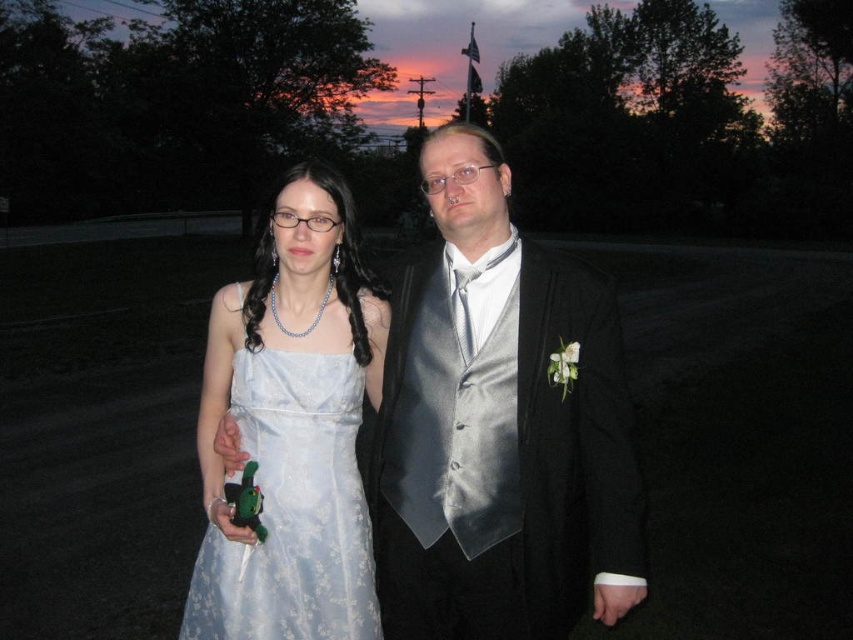
You are a fashion designer observing two satin dresses in an outdoor evening setting. The scene has a person wearing a satin dress at center and another wearing a satin dress at left. Which dress would you recommend for a client who prefers a more dramatic look, and why?

The satin dress at center is bigger than the satin dress at left, so it would be more dramatic and eye catching.

You are a photographer setting up a shoot. You need to position a spotlight so that it illuminates both the satin dress at center and the satin dress at left without casting shadows over the other. Based on their positions, which dress should the spotlight be placed closer to?

The spotlight should be placed closer to the satin dress at center because it is in front of the satin dress at left, so positioning the light closer to the front dress will help avoid casting a shadow over the one behind.

Based on the scene description, which object is wider, the satin dress at center or the satin dress at left?

The satin dress at center might be wider than satin dress at left according to the description.